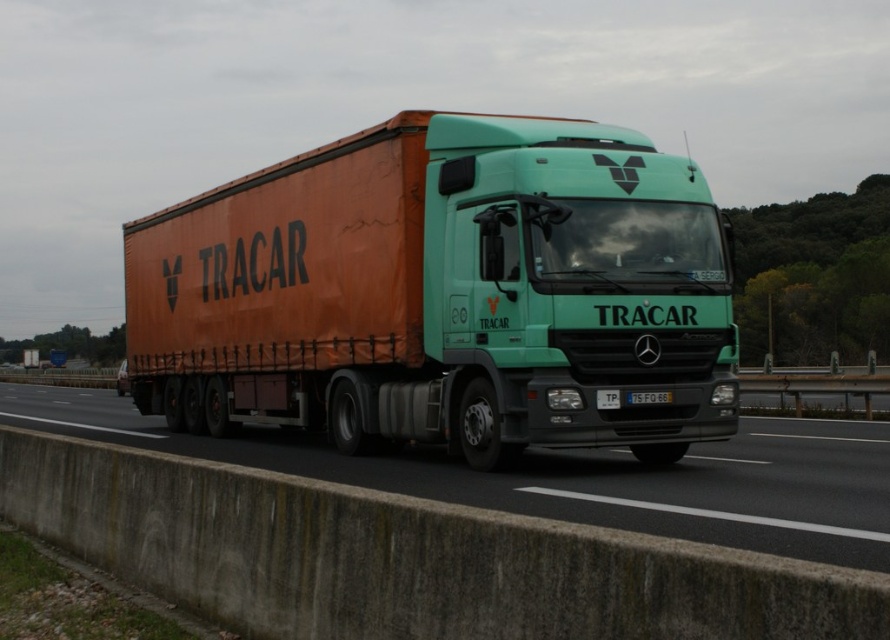
Question: Which point is closer to the camera taking this photo?

Choices:
 (A) click(x=503, y=209)
 (B) click(x=640, y=392)
 (C) click(x=543, y=481)

Answer: (C)

Question: Which object is the closest to the concrete barrier at lower center?

Choices:
 (A) orange fabric trailer truck at center
 (B) white plastic license plate at center

Answer: (A)

Question: Can you confirm if orange fabric trailer truck at center is positioned above white plastic license plate at center?

Choices:
 (A) no
 (B) yes

Answer: (B)

Question: Which point is farther from the camera taking this photo?

Choices:
 (A) (480, 129)
 (B) (783, 516)
 (C) (664, 400)

Answer: (A)

Question: Is concrete barrier at lower center positioned in front of white plastic license plate at center?

Choices:
 (A) no
 (B) yes

Answer: (B)

Question: Does concrete barrier at lower center have a larger size compared to white plastic license plate at center?

Choices:
 (A) no
 (B) yes

Answer: (B)